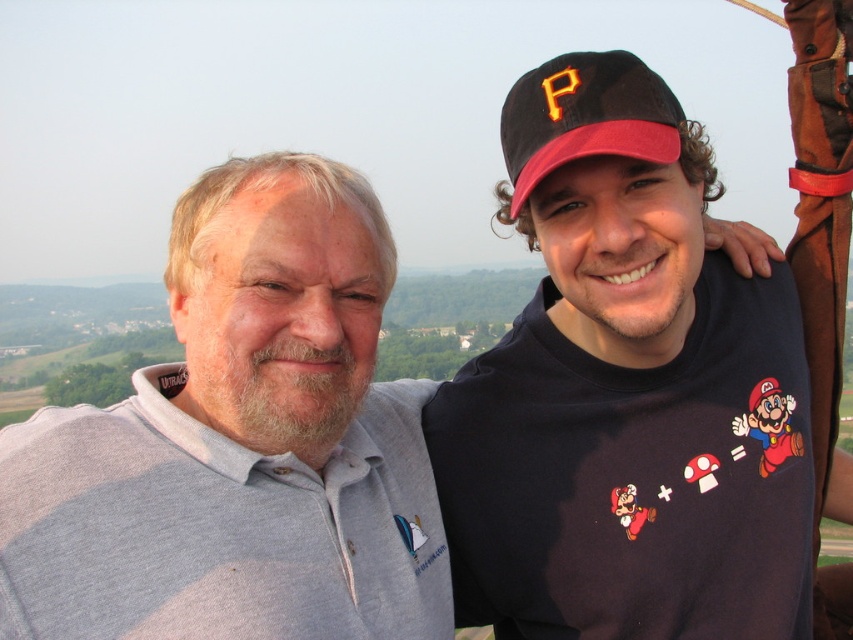
You are a photographer trying to capture a candid shot of the two people in the scene. You want to ensure that both the gray cotton shirt at upper left and the black fabric baseball cap at upper right are clearly visible in the frame. Based on their positions, which object should you focus on first to ensure both are in focus?

The gray cotton shirt at upper left is to the left of the black fabric baseball cap at upper right, so focusing on the gray cotton shirt at upper left first will help ensure both are in focus since it is closer to the camera.